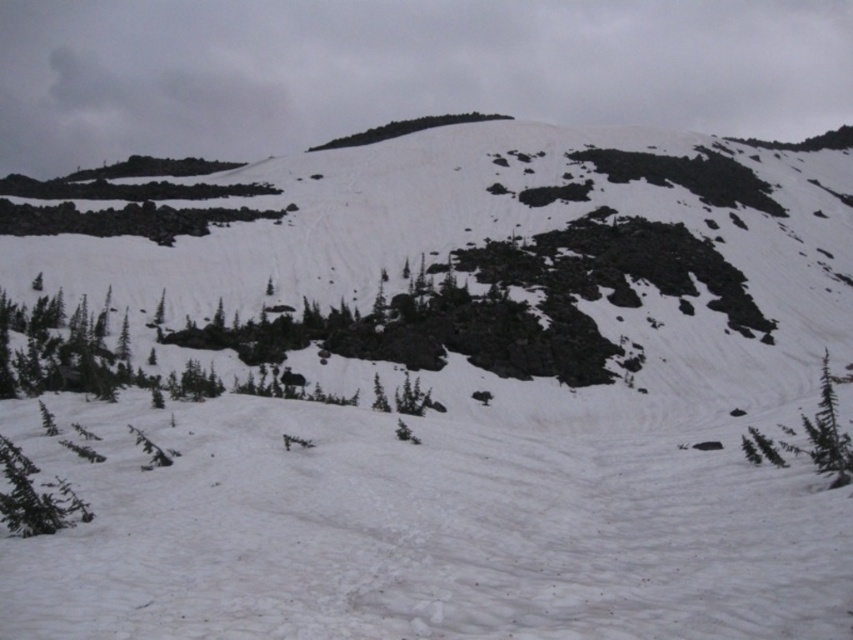
You are a hiker planning to navigate through the snowy mountainous terrain. You see a point marked at coordinates (33, 497). What object is located at that point?

The point at coordinates (33, 497) indicates a green matte tree at lower left.

You are a hiker planning to walk from the green leafy tree at upper center to the green leafy tree at lower right. Which direction should you head towards?

The green leafy tree at lower right is positioned on the right side of green leafy tree at upper center, so you should head towards the right direction.

You are planning to place a small wooden bench between the green matte tree at lower left and the green leafy tree at lower right. Which tree should the bench be closer to if you want it to be equidistant from both trees based on their widths?

The bench should be closer to the green matte tree at lower left because it has a smaller width than the green leafy tree at lower right. To be equidistant from both trees based on their widths, the bench needs to compensate for the difference in their sizes.